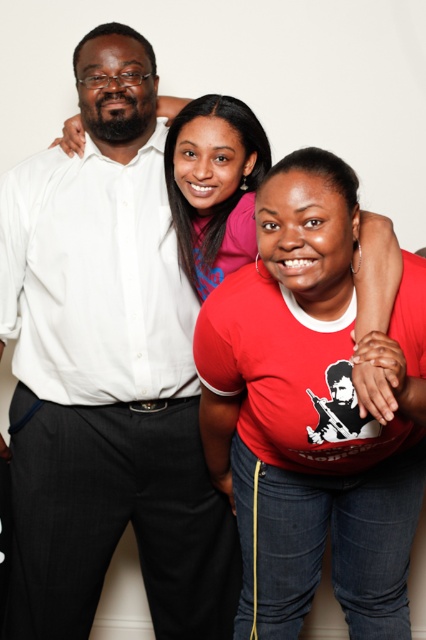
Is point (192, 577) more distant than point (333, 316)?

Yes, point (192, 577) is farther from viewer.

Image resolution: width=426 pixels, height=640 pixels. I want to click on white shirt at center, so click(x=106, y=372).

In order to click on white shirt at center in this screenshot , I will do (x=106, y=372).